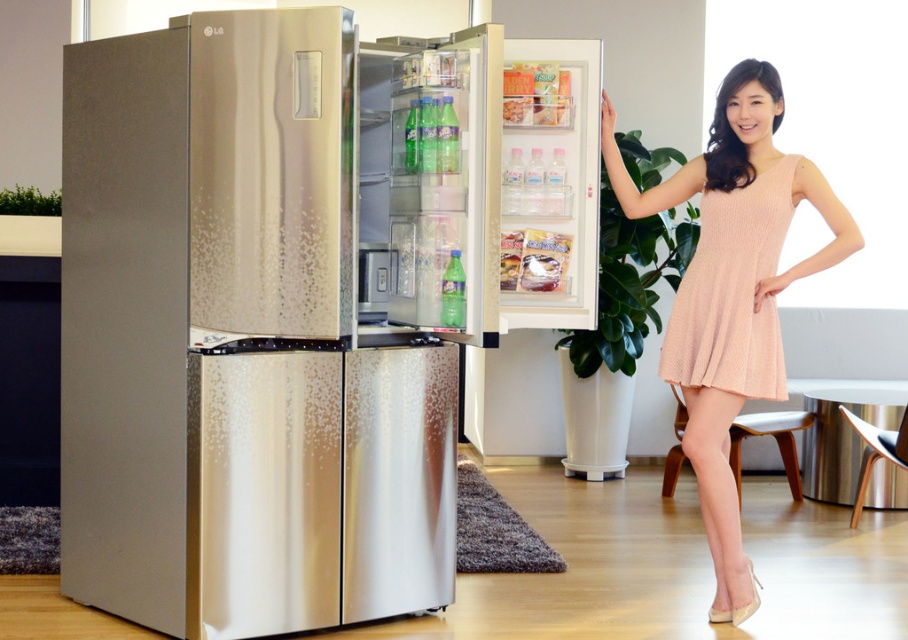
You are a fashion designer who wants to display two dresses side by side in a store window. The store window has a display space that is 8 inches wide. If you place the pink knit dress at center and the peach textured dress at right next to each other, will they fit within the display space?

The pink knit dress at center is 4.47 inches away from the peach textured dress at right. Since the total distance between them is 4.47 inches and the display space is 8 inches wide, there is enough space to fit both dresses side by side with room to spare.

Looking at this image, you are a delivery person who just arrived to deliver a package to the house. You see the brushed metal refrigerator at center and the pink knit dress at center in the image. Which object is taller?

The brushed metal refrigerator at center is much taller than the pink knit dress at center.

You are a delivery person who just arrived with a package for the homeowner. You see the brushed metal refrigerator at center and the peach textured dress at right. If the package is 1.8 meters long, can you place it horizontally between the two items without bending it?

The distance between the brushed metal refrigerator at center and the peach textured dress at right is 1.68 meters. Since the package is 1.8 meters long, it cannot fit horizontally between them without bending.